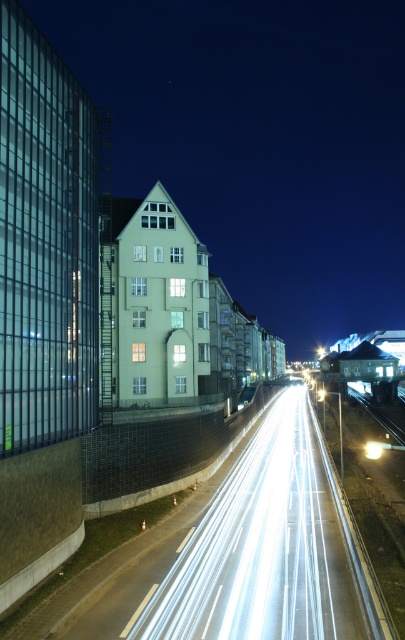
Question: Observing the image, what is the correct spatial positioning of metallic silver car at center in reference to white glossy light at center?

Choices:
 (A) below
 (B) above

Answer: (B)

Question: Which object is the closest to the metallic silver car at center?

Choices:
 (A) white glossy light at center
 (B) white glossy highway at center

Answer: (B)

Question: Observing the image, what is the correct spatial positioning of white glossy highway at center in reference to white glossy light at center?

Choices:
 (A) left
 (B) right

Answer: (A)

Question: Can you confirm if metallic silver car at center is positioned below white glossy light at center?

Choices:
 (A) no
 (B) yes

Answer: (A)

Question: Considering the real-world distances, which object is closest to the white glossy light at center?

Choices:
 (A) metallic silver car at center
 (B) white glossy highway at center

Answer: (B)

Question: Which of the following is the closest to the observer?

Choices:
 (A) white glossy highway at center
 (B) metallic silver car at center

Answer: (A)